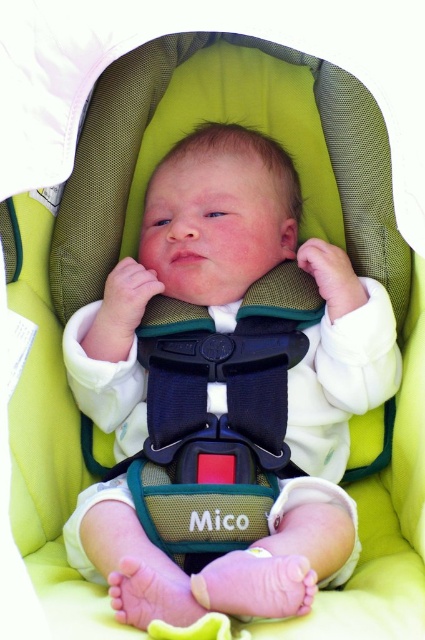
You are a parent checking the safety of your child in the car seat. You see the white soft baby at center and the black plastic buckle at center. Which object is positioned higher?

The white soft baby at center is above the black plastic buckle at center.

Where is the white soft baby at center located in the image?

The white soft baby at center is located at point coordinates of (227, 330).

You are a safety inspector checking the installation of a car seat. You need to ensure the baby is positioned correctly. According to the manufacturer guidelines, the baby should be no closer than 30 inches from the airbag. Is the white soft baby at center positioned safely?

The white soft baby at center is positioned safely as the distance from the viewer is 32.71 inches, which is greater than the required 30 inches minimum distance from the airbag.